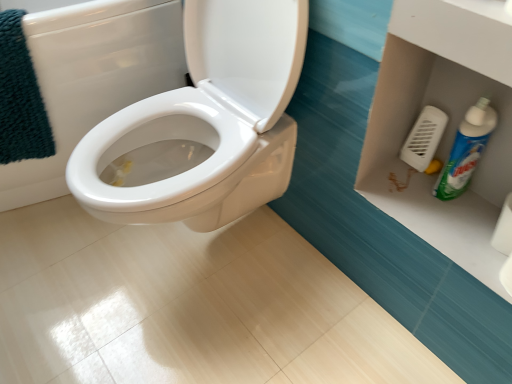
Identify the location of free space to the left of green plastic bottle at lower right. (399, 188).